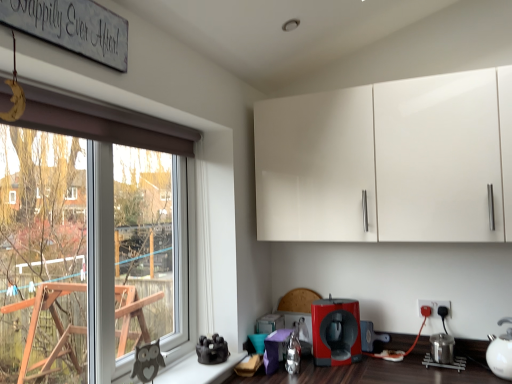
The height and width of the screenshot is (384, 512). Describe the element at coordinates (434, 307) in the screenshot. I see `matte black electric outlet at lower right` at that location.

Describe the element at coordinates (500, 354) in the screenshot. This screenshot has height=384, width=512. I see `white glossy tea pot at lower right` at that location.

Measure the distance between wooden signboard at upper left and camera.

A distance of 95.50 centimeters exists between wooden signboard at upper left and camera.

Image resolution: width=512 pixels, height=384 pixels. Describe the element at coordinates (72, 27) in the screenshot. I see `wooden signboard at upper left` at that location.

The width and height of the screenshot is (512, 384). Identify the location of white glossy cabinet at upper center. (388, 161).

The height and width of the screenshot is (384, 512). What do you see at coordinates (371, 336) in the screenshot? I see `matte red coffee machine at lower center, which is counted as the 1th coffee machine, starting from the back` at bounding box center [371, 336].

Image resolution: width=512 pixels, height=384 pixels. What are the coordinates of `matte black electric outlet at lower right` in the screenshot? It's located at (434, 307).

Who is more distant, wooden signboard at upper left or clear glass window at left?

clear glass window at left is further away from the camera.

What's the angular difference between wooden signboard at upper left and clear glass window at left's facing directions?

0.565 degrees.

Is wooden signboard at upper left next to clear glass window at left and touching it?

No.

From the image's perspective, is matte red coffee machine at lower center, the 1th coffee machine in the right-to-left sequence, positioned above or below white glossy tea pot at lower right?

Based on their image positions, matte red coffee machine at lower center, the 1th coffee machine in the right-to-left sequence, is located beneath white glossy tea pot at lower right.

Is matte red coffee machine at lower center, the 1th coffee machine in the right-to-left sequence, next to white glossy tea pot at lower right and touching it?

matte red coffee machine at lower center, the 1th coffee machine in the right-to-left sequence, and white glossy tea pot at lower right are not in contact.

Considering the positions of point (383, 337) and point (498, 321), is point (383, 337) closer or farther from the camera than point (498, 321)?

Point (383, 337).

Is matte red coffee machine at lower center, the 2th coffee machine positioned from the left, facing towards white glossy tea pot at lower right?

No, matte red coffee machine at lower center, the 2th coffee machine positioned from the left, is not facing towards white glossy tea pot at lower right.

Is the depth of matte red coffee machine at lower center, the 1th coffee machine in the right-to-left sequence, greater than that of matte black electric outlet at lower right?

Yes, the depth of matte red coffee machine at lower center, the 1th coffee machine in the right-to-left sequence, is greater than that of matte black electric outlet at lower right.

From the image's perspective, between matte red coffee machine at lower center, which is counted as the 1th coffee machine, starting from the back, and matte black electric outlet at lower right, which one is located above?

matte black electric outlet at lower right.

At what (x,y) coordinates should I click in order to perform the action: click on the 2nd coffee machine below when counting from the matte black electric outlet at lower right (from the image's perspective). Please return your answer as a coordinate pair (x, y). The height and width of the screenshot is (384, 512). Looking at the image, I should click on (371, 336).

From a real-world perspective, is white glossy tea pot at lower right located beneath clear glass window at left?

Correct, in the physical world, white glossy tea pot at lower right is lower than clear glass window at left.

Considering the relative sizes of white glossy tea pot at lower right and clear glass window at left in the image provided, is white glossy tea pot at lower right shorter than clear glass window at left?

Indeed, white glossy tea pot at lower right has a lesser height compared to clear glass window at left.

Is white glossy tea pot at lower right positioned far away from clear glass window at left?

Yes, white glossy tea pot at lower right is far from clear glass window at left.

Locate an element on the screen. window above the white glossy tea pot at lower right (from a real-world perspective) is located at coordinates (80, 242).

In the scene shown: Is clear glass window at left positioned with its back to wooden signboard at upper left?

No, clear glass window at left is not facing the opposite direction of wooden signboard at upper left.

Is point (86, 142) closer or farther from the camera than point (94, 45)?

Point (86, 142) is positioned farther from the camera compared to point (94, 45).

Is wooden signboard at upper left located within clear glass window at left?

Definitely not — wooden signboard at upper left is not inside clear glass window at left.

Identify the location of electric outlet to the left of white glossy tea pot at lower right. (434, 307).

Does matte black electric outlet at lower right touch white glossy tea pot at lower right?

No, matte black electric outlet at lower right is not making contact with white glossy tea pot at lower right.

Is matte black electric outlet at lower right facing towards white glossy tea pot at lower right?

No, matte black electric outlet at lower right is not facing towards white glossy tea pot at lower right.

Based on the photo, which is correct: matte black electric outlet at lower right is inside white glossy tea pot at lower right, or outside of it?

matte black electric outlet at lower right cannot be found inside white glossy tea pot at lower right.

Consider the image. Is matte red coffee machine at lower center, arranged as the second coffee machine when viewed from the back, taller than white glossy cabinet at upper center?

Incorrect, the height of matte red coffee machine at lower center, arranged as the second coffee machine when viewed from the back, is not larger of that of white glossy cabinet at upper center.

From the image's perspective, between matte red coffee machine at lower center, acting as the first coffee machine starting from the front, and white glossy cabinet at upper center, which one is located above?

white glossy cabinet at upper center.

In the image, is matte red coffee machine at lower center, acting as the first coffee machine starting from the front, positioned in front of or behind white glossy cabinet at upper center?

Visually, matte red coffee machine at lower center, acting as the first coffee machine starting from the front, is located behind white glossy cabinet at upper center.

From a real-world perspective, between matte red coffee machine at lower center, the second coffee machine from the right, and white glossy cabinet at upper center, who is vertically higher?

white glossy cabinet at upper center is physically above.

Where is `writing above the clear glass window at left (from the image's perspective)`? This screenshot has width=512, height=384. writing above the clear glass window at left (from the image's perspective) is located at coordinates (72, 27).

What are the coordinates of `tea pot to the right of matte red coffee machine at lower center, marked as the 2th coffee machine in a front-to-back arrangement` in the screenshot? It's located at (500, 354).

Based on their spatial positions, is white glossy tea pot at lower right or matte red coffee machine at lower center, which is the 1th coffee machine in left-to-right order, further from clear glass window at left?

white glossy tea pot at lower right is positioned further to the anchor clear glass window at left.

When comparing their distances from matte red coffee machine at lower center, the 2th coffee machine positioned from the left, does matte red coffee machine at lower center, acting as the first coffee machine starting from the front, or white glossy cabinet at upper center seem further?

white glossy cabinet at upper center is further to matte red coffee machine at lower center, the 2th coffee machine positioned from the left.

Based on their spatial positions, is clear glass window at left or white glossy tea pot at lower right further from matte red coffee machine at lower center, which is the 1th coffee machine in left-to-right order?

clear glass window at left is positioned further to the anchor matte red coffee machine at lower center, which is the 1th coffee machine in left-to-right order.

Based on their spatial positions, is matte black electric outlet at lower right or white glossy cabinet at upper center further from clear glass window at left?

matte black electric outlet at lower right is positioned further to the anchor clear glass window at left.

Looking at the image, which one is located closer to matte black electric outlet at lower right, matte red coffee machine at lower center, which is counted as the 1th coffee machine, starting from the back, or matte red coffee machine at lower center, which is the 1th coffee machine in left-to-right order?

Among the two, matte red coffee machine at lower center, which is counted as the 1th coffee machine, starting from the back, is located nearer to matte black electric outlet at lower right.

Which object lies nearer to the anchor point white glossy cabinet at upper center, white glossy tea pot at lower right or clear glass window at left?

Based on the image, clear glass window at left appears to be nearer to white glossy cabinet at upper center.

When comparing their distances from matte black electric outlet at lower right, does white glossy tea pot at lower right or white glossy cabinet at upper center seem further?

white glossy cabinet at upper center.

From the image, which object appears to be nearer to matte red coffee machine at lower center, arranged as the second coffee machine when viewed from the back, matte black electric outlet at lower right or clear glass window at left?

matte black electric outlet at lower right is closer to matte red coffee machine at lower center, arranged as the second coffee machine when viewed from the back.

The image size is (512, 384). Find the location of `writing between clear glass window at left and matte red coffee machine at lower center, the 1th coffee machine in the right-to-left sequence, from left to right`. writing between clear glass window at left and matte red coffee machine at lower center, the 1th coffee machine in the right-to-left sequence, from left to right is located at coordinates (72, 27).

Locate an element on the screen. cabinetry situated between wooden signboard at upper left and white glossy tea pot at lower right from left to right is located at coordinates (388, 161).

I want to click on electric outlet between matte red coffee machine at lower center, acting as the first coffee machine starting from the front, and white glossy tea pot at lower right, in the horizontal direction, so click(434, 307).

Locate an element on the screen. writing between clear glass window at left and white glossy tea pot at lower right is located at coordinates (72, 27).